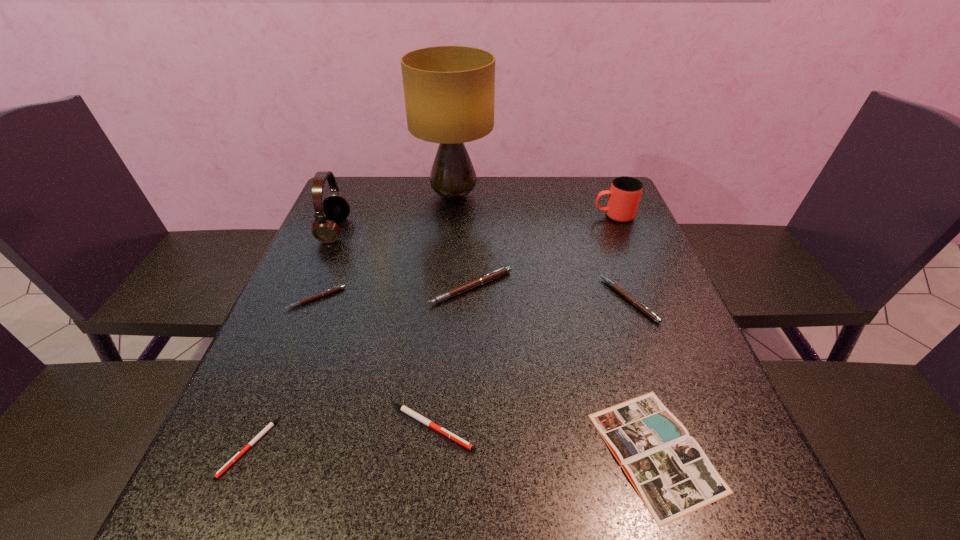
The width and height of the screenshot is (960, 540). What are the coordinates of `book that is at the near edge` in the screenshot? It's located at (671, 473).

Locate an element on the screen. The image size is (960, 540). pen located at the near edge is located at coordinates (271, 424).

The width and height of the screenshot is (960, 540). Identify the location of headset present at the left edge. (336, 208).

Where is `cup located in the right edge section of the desktop`? The height and width of the screenshot is (540, 960). cup located in the right edge section of the desktop is located at coordinates (624, 195).

Where is `pen present at the right edge`? pen present at the right edge is located at coordinates (626, 295).

I want to click on book that is at the right edge, so click(671, 473).

You are a GUI agent. You are given a task and a screenshot of the screen. Output one action in this format:
    pyautogui.click(x=<x>, y=<y>)
    Task: Click on the object located in the far left corner section of the desktop
    
    Given the screenshot: What is the action you would take?
    pyautogui.click(x=336, y=208)

Find the location of a particular element. This screenshot has width=960, height=540. object situated at the near left corner is located at coordinates (271, 424).

Where is `object at the far right corner`? The image size is (960, 540). object at the far right corner is located at coordinates (624, 195).

Locate an element on the screen. This screenshot has height=540, width=960. object present at the near right corner is located at coordinates (671, 473).